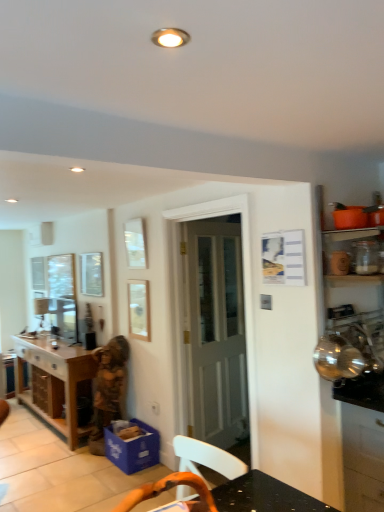
In order to face white wooden door at center, should I rotate leftwards or rightwards?

You should rotate right by 4.281 degrees.

Describe the element at coordinates (109, 383) in the screenshot. I see `wooden statue at center` at that location.

What is the approximate height of translucent glass jar at upper right?

It is 39.06 inches.

Where is `translucent glass jar at upper right`? translucent glass jar at upper right is located at coordinates (355, 358).

You are a GUI agent. You are given a task and a screenshot of the screen. Output one action in this format:
    pyautogui.click(x=<x>, y=<y>)
    Task: Click on the blue cardboard box at lower center, the 1th cabinetry when ordered from back to front
    
    Given the screenshot: What is the action you would take?
    pyautogui.click(x=133, y=448)

Describe the element at coordinates (133, 448) in the screenshot. The image size is (384, 512). I see `blue cardboard box at lower center, positioned as the 2th cabinetry in right-to-left order` at that location.

The height and width of the screenshot is (512, 384). Describe the element at coordinates (363, 442) in the screenshot. I see `satin black cabinet at right, the 1th cabinetry positioned from the front` at that location.

Where is `wooden table at lower left`? The height and width of the screenshot is (512, 384). wooden table at lower left is located at coordinates (54, 381).

Relative to blue cardboard box at lower center, positioned as the 2th cabinetry in right-to-left order, is satin black cabinet at right, the 1th cabinetry positioned from the front, in front or behind?

Visually, satin black cabinet at right, the 1th cabinetry positioned from the front, is located in front of blue cardboard box at lower center, positioned as the 2th cabinetry in right-to-left order.

In the image, is satin black cabinet at right, acting as the first cabinetry starting from the right, on the left side or the right side of blue cardboard box at lower center, the 1th cabinetry when ordered from back to front?

From the image, it's evident that satin black cabinet at right, acting as the first cabinetry starting from the right, is to the right of blue cardboard box at lower center, the 1th cabinetry when ordered from back to front.

Which of these two, satin black cabinet at right, acting as the first cabinetry starting from the right, or blue cardboard box at lower center, the 1th cabinetry when ordered from back to front, is smaller?

blue cardboard box at lower center, the 1th cabinetry when ordered from back to front.

Which of these two, satin black cabinet at right, which is the second cabinetry in left-to-right order, or blue cardboard box at lower center, the second cabinetry when ordered from front to back, stands shorter?

blue cardboard box at lower center, the second cabinetry when ordered from front to back.

From a real-world perspective, which is physically above, satin black cabinet at right, which is the second cabinetry in left-to-right order, or wooden statue at center?

wooden statue at center.

Is satin black cabinet at right, marked as the 2th cabinetry in a back-to-front arrangement, to the left of wooden statue at center from the viewer's perspective?

No, satin black cabinet at right, marked as the 2th cabinetry in a back-to-front arrangement, is not to the left of wooden statue at center.

Is point (363, 467) behind point (118, 338)?

No.

Which of these two, wooden table at lower left or satin black cabinet at right, acting as the first cabinetry starting from the right, is bigger?

With larger size is wooden table at lower left.

Does point (44, 407) lie in front of point (354, 404)?

No, (44, 407) is behind (354, 404).

Are wooden table at lower left and satin black cabinet at right, the 1th cabinetry positioned from the front, far apart?

Absolutely, wooden table at lower left is distant from satin black cabinet at right, the 1th cabinetry positioned from the front.

Considering the relative sizes of wooden picture frame at center and wooden table at lower left in the image provided, is wooden picture frame at center taller than wooden table at lower left?

No.

Is wooden picture frame at center far from wooden table at lower left?

Result: That's right, there is a large distance between wooden picture frame at center and wooden table at lower left.

Find the location of a particular element. table lying on the left of wooden picture frame at center is located at coordinates (54, 381).

From the image's perspective, which is below, wooden picture frame at center or wooden table at lower left?

wooden table at lower left, from the image's perspective.

Considering the relative positions of satin black cabinet at right, which is the second cabinetry in left-to-right order, and wooden table at lower left in the image provided, is satin black cabinet at right, which is the second cabinetry in left-to-right order, to the right of wooden table at lower left from the viewer's perspective?

Yes, satin black cabinet at right, which is the second cabinetry in left-to-right order, is to the right of wooden table at lower left.

Does satin black cabinet at right, acting as the first cabinetry starting from the right, have a lesser height compared to wooden table at lower left?

Incorrect, the height of satin black cabinet at right, acting as the first cabinetry starting from the right, does not fall short of that of wooden table at lower left.

Consider the image. From a real-world perspective, is satin black cabinet at right, acting as the first cabinetry starting from the right, located beneath wooden table at lower left?

Incorrect, from a real-world perspective, satin black cabinet at right, acting as the first cabinetry starting from the right, is higher than wooden table at lower left.

Who is bigger, satin black cabinet at right, acting as the first cabinetry starting from the right, or wooden table at lower left?

Bigger between the two is wooden table at lower left.

Where is `door above the blue cardboard box at lower center, the 1th cabinetry when ordered from back to front (from a real-world perspective)`? The image size is (384, 512). door above the blue cardboard box at lower center, the 1th cabinetry when ordered from back to front (from a real-world perspective) is located at coordinates (215, 331).

From the image's perspective, between blue cardboard box at lower center, positioned as the 2th cabinetry in right-to-left order, and white wooden door at center, which one is located above?

white wooden door at center is shown above in the image.

Which is more to the left, blue cardboard box at lower center, positioned as the 2th cabinetry in right-to-left order, or white wooden door at center?

blue cardboard box at lower center, positioned as the 2th cabinetry in right-to-left order.

In the scene shown: Which is in front, blue cardboard box at lower center, the 1th cabinetry when ordered from back to front, or white wooden door at center?

blue cardboard box at lower center, the 1th cabinetry when ordered from back to front, is in front.

Considering the sizes of objects wooden table at lower left and wooden statue at center in the image provided, who is thinner, wooden table at lower left or wooden statue at center?

With smaller width is wooden statue at center.

Considering the positions of objects wooden table at lower left and wooden statue at center in the image provided, who is more to the left, wooden table at lower left or wooden statue at center?

Positioned to the left is wooden table at lower left.

You are a GUI agent. You are given a task and a screenshot of the screen. Output one action in this format:
    pyautogui.click(x=<x>, y=<y>)
    Task: Click on the person located in front of the wooden table at lower left
    
    Given the screenshot: What is the action you would take?
    pyautogui.click(x=109, y=383)

The height and width of the screenshot is (512, 384). In order to click on cabinetry above the blue cardboard box at lower center, the second cabinetry when ordered from front to back (from the image's perspective) in this screenshot , I will do `click(363, 442)`.

Where is `person located below the satin black cabinet at right, marked as the 2th cabinetry in a back-to-front arrangement (from the image's perspective)`? person located below the satin black cabinet at right, marked as the 2th cabinetry in a back-to-front arrangement (from the image's perspective) is located at coordinates (109, 383).

Estimate the real-world distances between objects in this image. Which object is closer to wooden statue at center, satin black cabinet at right, the 1th cabinetry positioned from the front, or blue cardboard box at lower center, positioned as the 2th cabinetry in right-to-left order?

Among the two, blue cardboard box at lower center, positioned as the 2th cabinetry in right-to-left order, is located nearer to wooden statue at center.

Based on their spatial positions, is wooden table at lower left or translucent glass jar at upper right further from wooden statue at center?

translucent glass jar at upper right is positioned further to the anchor wooden statue at center.

When comparing their distances from wooden table at lower left, does blue cardboard box at lower center, placed as the first cabinetry when sorted from left to right, or satin black cabinet at right, the 1th cabinetry positioned from the front, seem further?

satin black cabinet at right, the 1th cabinetry positioned from the front, lies further to wooden table at lower left than the other object.

Estimate the real-world distances between objects in this image. Which object is further from translucent glass jar at upper right, blue cardboard box at lower center, placed as the first cabinetry when sorted from left to right, or wooden picture frame at center?

wooden picture frame at center is further to translucent glass jar at upper right.

Consider the image. Considering their positions, is wooden picture frame at center positioned further to white wooden door at center than blue cardboard box at lower center, positioned as the 2th cabinetry in right-to-left order?

blue cardboard box at lower center, positioned as the 2th cabinetry in right-to-left order, is further to white wooden door at center.

From the image, which object appears to be farther from wooden table at lower left, translucent glass jar at upper right or wooden picture frame at center?

translucent glass jar at upper right is further to wooden table at lower left.

Looking at this image, when comparing their distances from wooden picture frame at center, does satin black cabinet at right, marked as the 2th cabinetry in a back-to-front arrangement, or wooden table at lower left seem closer?

Among the two, wooden table at lower left is located nearer to wooden picture frame at center.

Which object lies nearer to the anchor point wooden table at lower left, satin black cabinet at right, acting as the first cabinetry starting from the right, or wooden statue at center?

Among the two, wooden statue at center is located nearer to wooden table at lower left.

This screenshot has width=384, height=512. In order to click on cabinetry between wooden statue at center and translucent glass jar at upper right in this screenshot , I will do `click(133, 448)`.

Image resolution: width=384 pixels, height=512 pixels. Find the location of `door between translucent glass jar at upper right and wooden picture frame at center from front to back`. door between translucent glass jar at upper right and wooden picture frame at center from front to back is located at coordinates (215, 331).

At what (x,y) coordinates should I click in order to perform the action: click on person between wooden table at lower left and wooden picture frame at center. Please return your answer as a coordinate pair (x, y). The width and height of the screenshot is (384, 512). Looking at the image, I should click on (109, 383).

Locate an element on the screen. Image resolution: width=384 pixels, height=512 pixels. cabinetry between wooden statue at center and satin black cabinet at right, acting as the first cabinetry starting from the right is located at coordinates (133, 448).